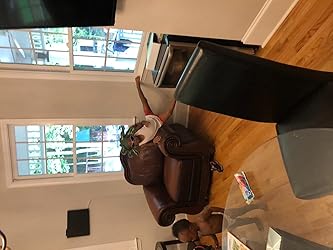
This screenshot has width=333, height=250. Find the location of `clock`. clock is located at coordinates (2, 242).